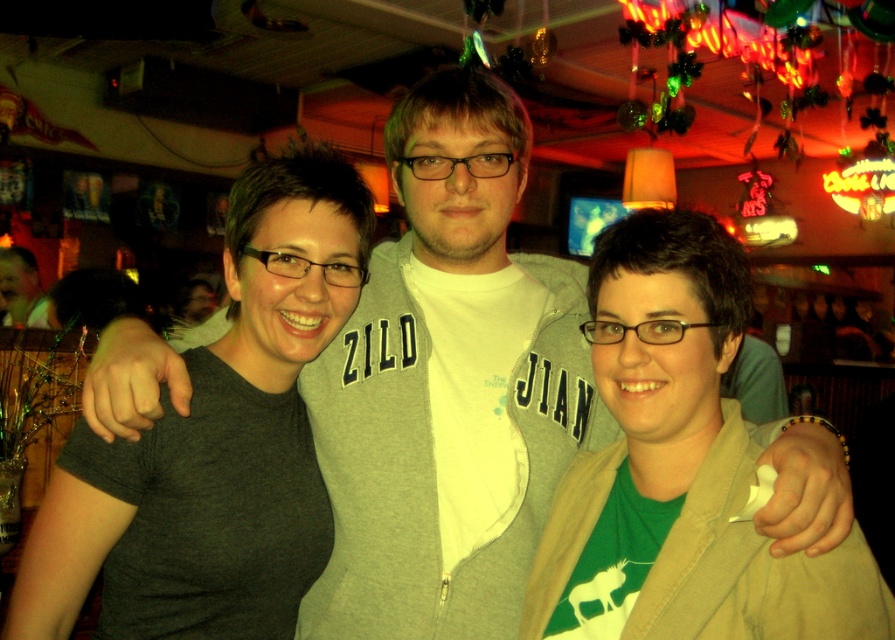
Can you confirm if dark gray t-shirt at center is positioned above matte black shirt at left?

No, dark gray t-shirt at center is not above matte black shirt at left.

Is dark gray t-shirt at center smaller than matte black shirt at left?

Yes.

Between point (52, 556) and point (47, 317), which one is positioned behind?

Positioned behind is point (47, 317).

The width and height of the screenshot is (895, 640). What are the coordinates of `dark gray t-shirt at center` in the screenshot? It's located at (216, 442).